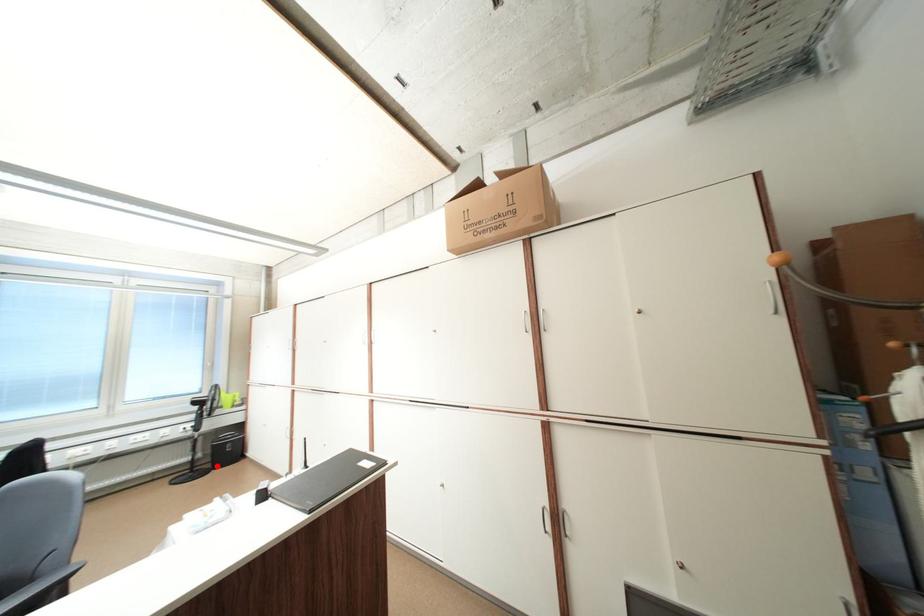
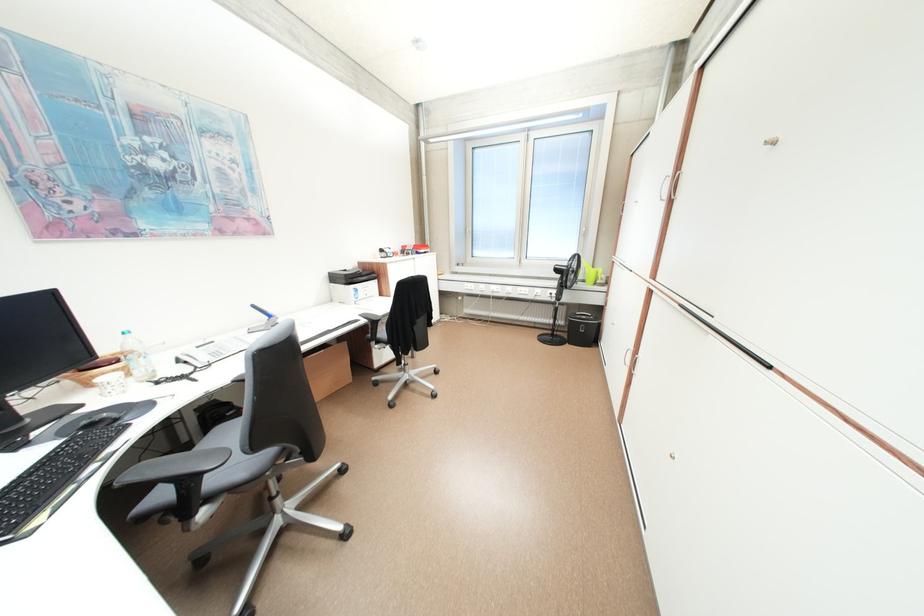
Find the pixel in the second image that matches the highlighted location in the first image.

(576, 337)